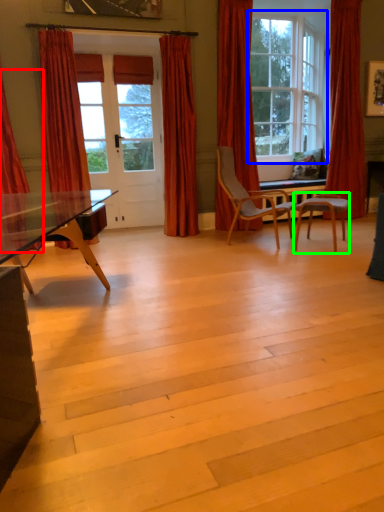
Question: Which is farther away from curtain (highlighted by a red box)? window (highlighted by a blue box) or chair (highlighted by a green box)?

Choices:
 (A) window
 (B) chair

Answer: (A)